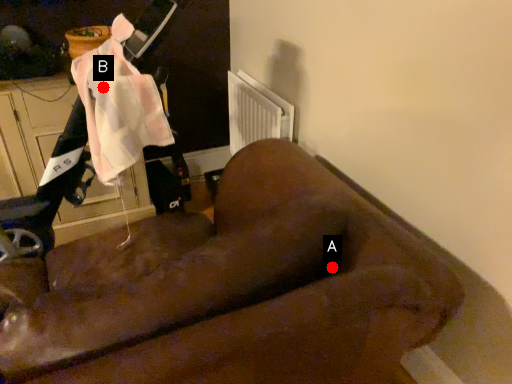
Question: Two points are circled on the image, labeled by A and B beside each circle. Which point is farther from the camera taking this photo?

Choices:
 (A) A is further
 (B) B is further

Answer: (B)